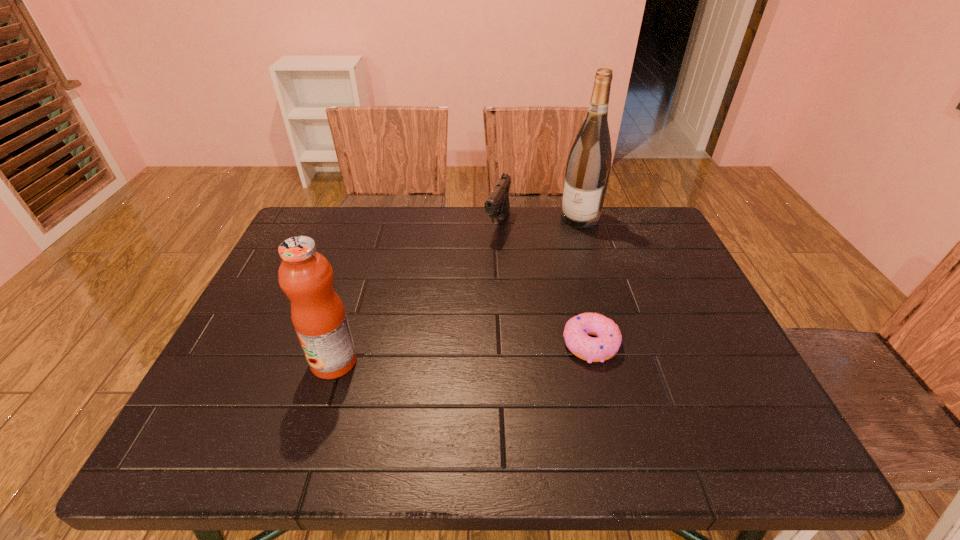
This screenshot has height=540, width=960. Identify the location of vacant space on the desktop that is between the second tallest object and the doughnut and is positioned at the barrel of the second object from left to right. (430, 355).

Find the location of a particular element. This screenshot has height=540, width=960. vacant space on the desktop that is between the third shortest object and the doughnut and is positioned on the label of the tallest object is located at coordinates (491, 350).